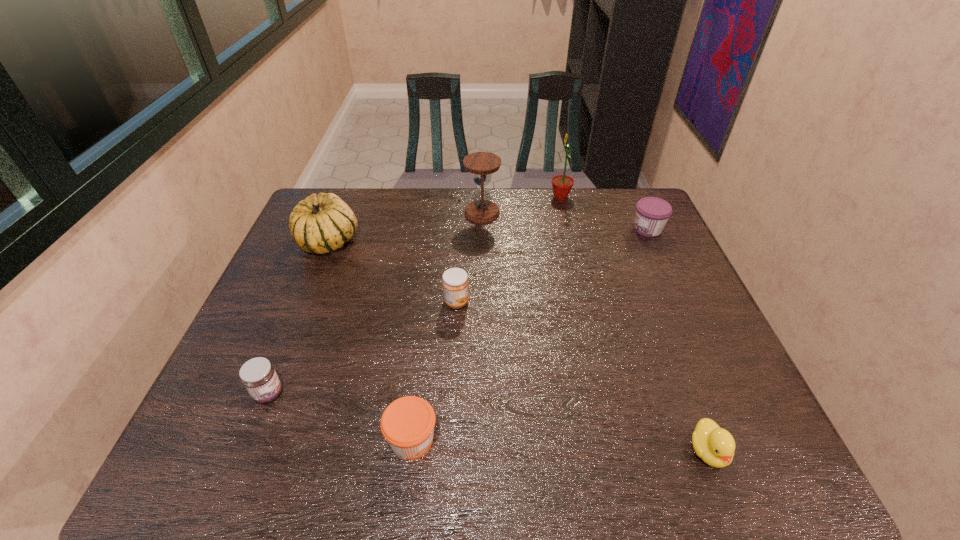
Identify the location of duckling that is at the right edge. (715, 446).

The width and height of the screenshot is (960, 540). Identify the location of object that is at the far left corner. (321, 223).

The image size is (960, 540). In order to click on object located in the far right corner section of the desktop in this screenshot , I will do `click(652, 214)`.

Locate an element on the screen. This screenshot has height=540, width=960. object present at the near right corner is located at coordinates (715, 446).

In the image, there is a desktop. Where is `vacant space at the far edge`? vacant space at the far edge is located at coordinates point(600,195).

Where is `vacant space at the left edge of the desktop`? The height and width of the screenshot is (540, 960). vacant space at the left edge of the desktop is located at coordinates (263, 323).

Locate an element on the screen. This screenshot has height=540, width=960. blank area at the right edge is located at coordinates (632, 241).

You are a GUI agent. You are given a task and a screenshot of the screen. Output one action in this format:
    pyautogui.click(x=<x>, y=<y>)
    Task: Click on the vacant area at the near right corner of the desktop
    This screenshot has width=960, height=540.
    Given the screenshot: What is the action you would take?
    pyautogui.click(x=777, y=450)

Locate an element on the screen. The image size is (960, 540). blank region between the duckling and the farthest jam is located at coordinates (678, 340).

This screenshot has height=540, width=960. What are the coordinates of `empty location between the sunflower and the nearest jam` in the screenshot? It's located at [x=487, y=319].